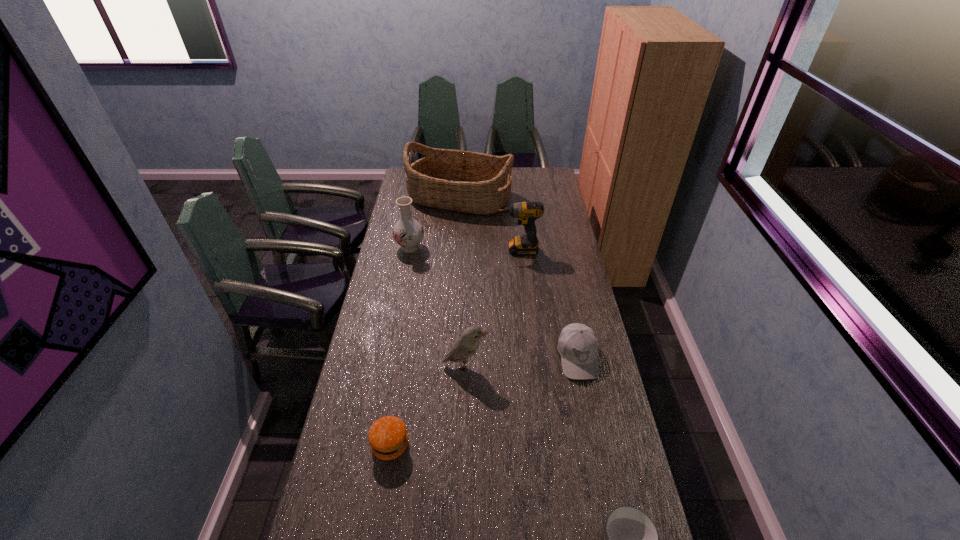
Where is `free point located 0.060m with the drill bit of the drill facing forward`? This screenshot has width=960, height=540. free point located 0.060m with the drill bit of the drill facing forward is located at coordinates (482, 250).

Find the location of `free space located 0.290m on the front of the vase`. free space located 0.290m on the front of the vase is located at coordinates (399, 303).

Find the location of a particular element. The width and height of the screenshot is (960, 540). free point located at the face of the bird is located at coordinates (511, 365).

Locate an element on the screen. The image size is (960, 540). vacant area situated on the front-facing side of the fifth tallest object is located at coordinates (594, 438).

At what (x,y) coordinates should I click in order to perform the action: click on vacant area located 0.110m on the left of the second nearest object. Please return your answer as a coordinate pair (x, y). Looking at the image, I should click on (335, 445).

Where is `object at the far edge`? The width and height of the screenshot is (960, 540). object at the far edge is located at coordinates (471, 182).

What are the coordinates of `basket positioned at the left edge` in the screenshot? It's located at (471, 182).

This screenshot has width=960, height=540. What are the coordinates of `vase located in the left edge section of the desktop` in the screenshot? It's located at (407, 232).

The height and width of the screenshot is (540, 960). I want to click on patty situated at the left edge, so click(x=387, y=436).

Locate an element on the screen. Image resolution: width=960 pixels, height=540 pixels. object that is at the right edge is located at coordinates (578, 345).